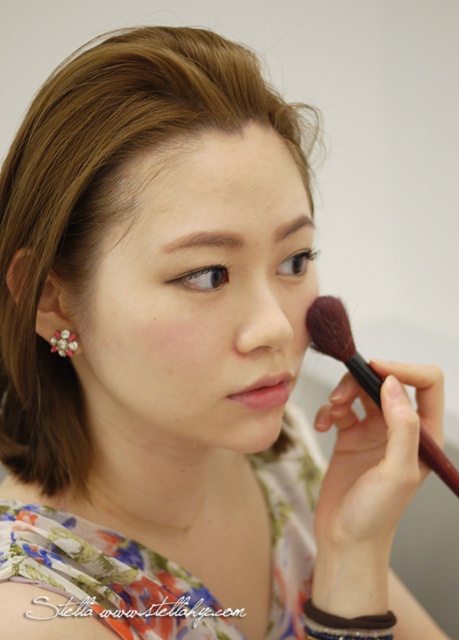
Based on the scene, can you determine which object is taller between the smooth skin at center and the pearlelegantearring at left?

The smooth skin at center is much taller than the pearlelegantearring at left according to the description.

You are a photographer adjusting your camera to focus on two points in the image. The first point is at coordinates point (268,396) and the second is at point (72,348). Which point is closer to you?

Point (268,396) is closer to the viewer than point (72,348).

You are a makeup artist preparing for a client. You have a matte pink lipstick at lower right and a pearlelegantearring at left. Which item is located to the right of the other?

The matte pink lipstick at lower right is positioned on the right side of pearlelegantearring at left.